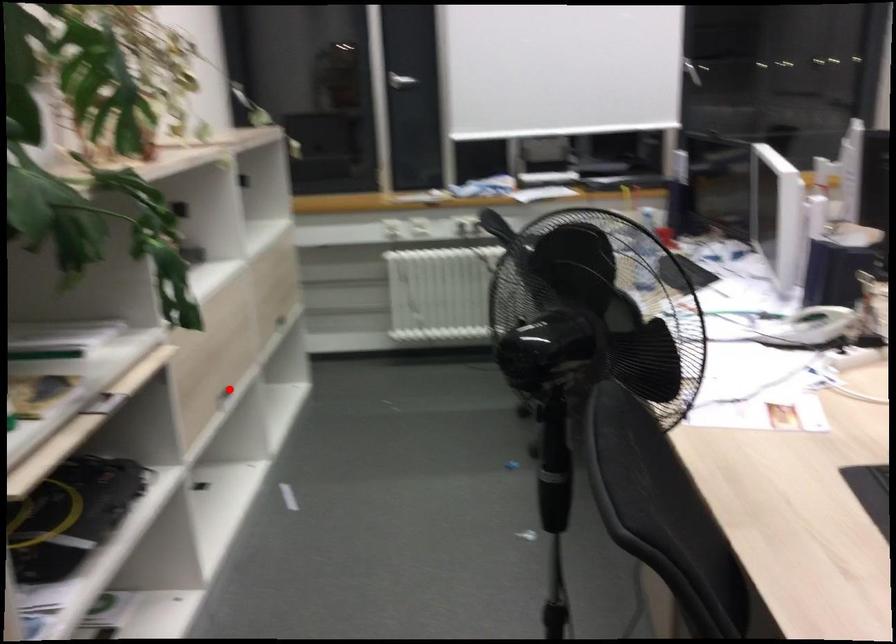
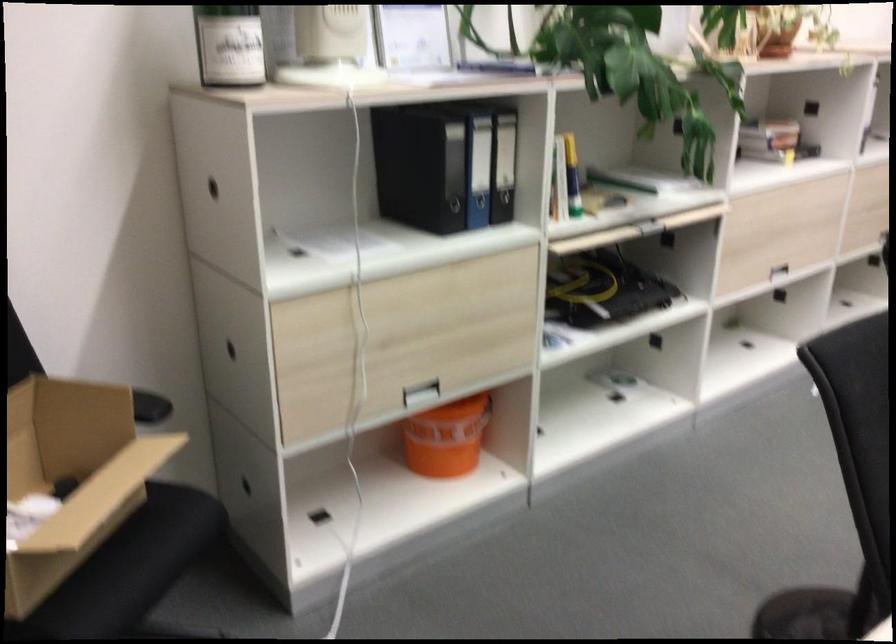
Find the pixel in the second image that matches the highlighted location in the first image.

(771, 266)